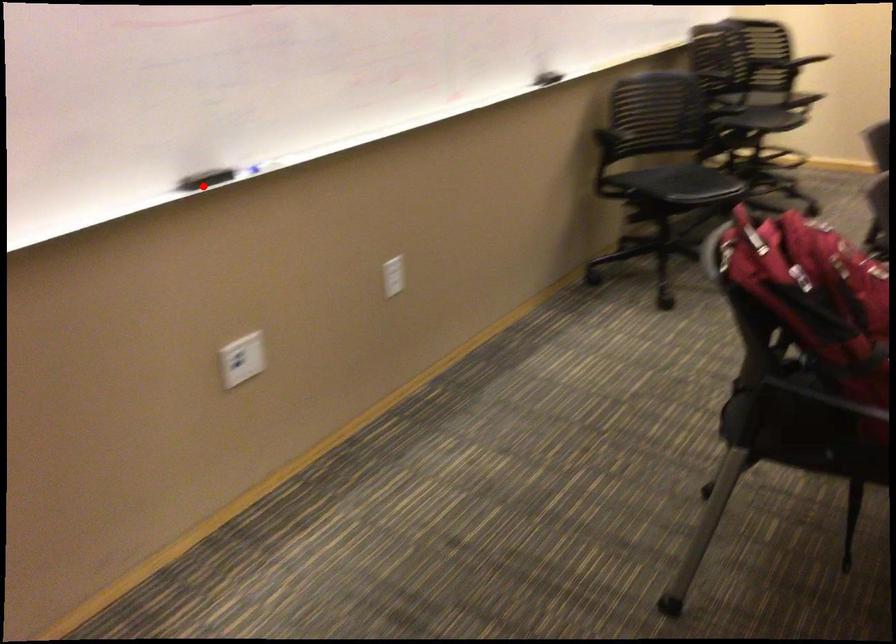
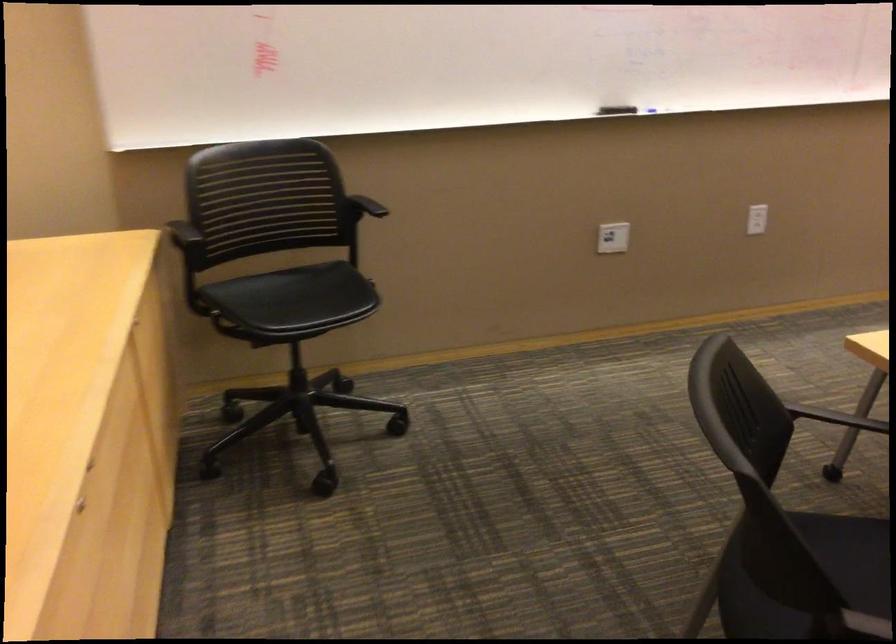
In the second image, find the point that corresponds to the highlighted location in the first image.

(616, 109)